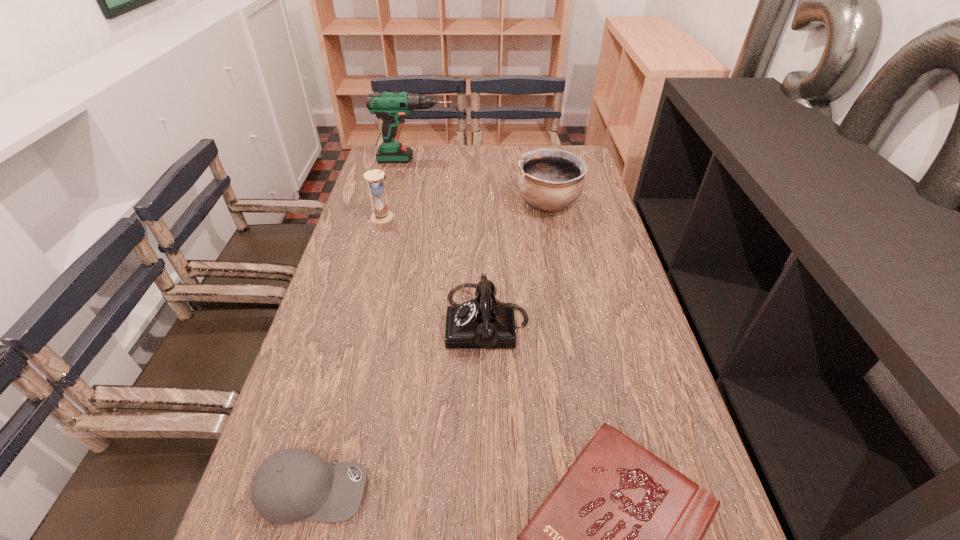
Identify the location of the farthest object. (392, 106).

The image size is (960, 540). What are the coordinates of `drill` in the screenshot? It's located at (392, 106).

This screenshot has width=960, height=540. I want to click on hourglass, so click(375, 178).

Locate an element on the screen. The width and height of the screenshot is (960, 540). the fourth shortest object is located at coordinates (548, 179).

The image size is (960, 540). I want to click on the third shortest object, so click(483, 322).

Where is `telephone`? The height and width of the screenshot is (540, 960). telephone is located at coordinates (483, 322).

At what (x,y) coordinates should I click in order to perform the action: click on the fifth tallest object. Please return your answer as a coordinate pair (x, y). Image resolution: width=960 pixels, height=540 pixels. Looking at the image, I should click on (291, 485).

This screenshot has height=540, width=960. I want to click on vacant space located on the handle side of the drill, so click(x=531, y=160).

Locate an element on the screen. The width and height of the screenshot is (960, 540). vacant point located 0.320m on the back of the hourglass is located at coordinates (397, 162).

You are a GUI agent. You are given a task and a screenshot of the screen. Output one action in this format:
    pyautogui.click(x=<x>, y=<y>)
    Task: Click on the blank area located 0.340m on the left of the fourth shortest object
    Image resolution: width=960 pixels, height=540 pixels.
    Given the screenshot: What is the action you would take?
    (x=413, y=203)